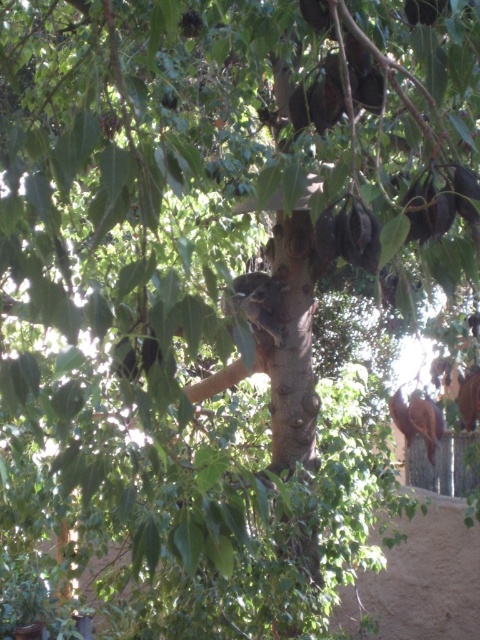
You are a bird flying over the tree and want to land on the brown fuzzy fruit at upper center. Where should you aim based on its 2D coordinates?

The brown fuzzy fruit at upper center is located at the 2D coordinates point (x=424, y=10), so you should aim for that point to land on it.

You are standing at point A, which is at coordinates point A at (428, 19). You want to walk to point B, which is 7.08 feet away from point A. Considering the tree and its branches, will you have enough space to walk straight from point A to point B without touching any branches?

The distance between point A at (428, 19) and point B is 7.08 feet. Since the tree has branches extending outward in various directions, but the description does not specify their exact positions or sizes relative to the path between the points, it is uncertain whether there will be enough space to walk straight without touching any branches.

You are a botanist examining the tree and need to determine which fruit is closer to the ground. You see the brown fuzzy fruit at upper center and the green matte fruit at upper center. Which one is lower?

The brown fuzzy fruit at upper center is shorter than the green matte fruit at upper center, so it is closer to the ground.